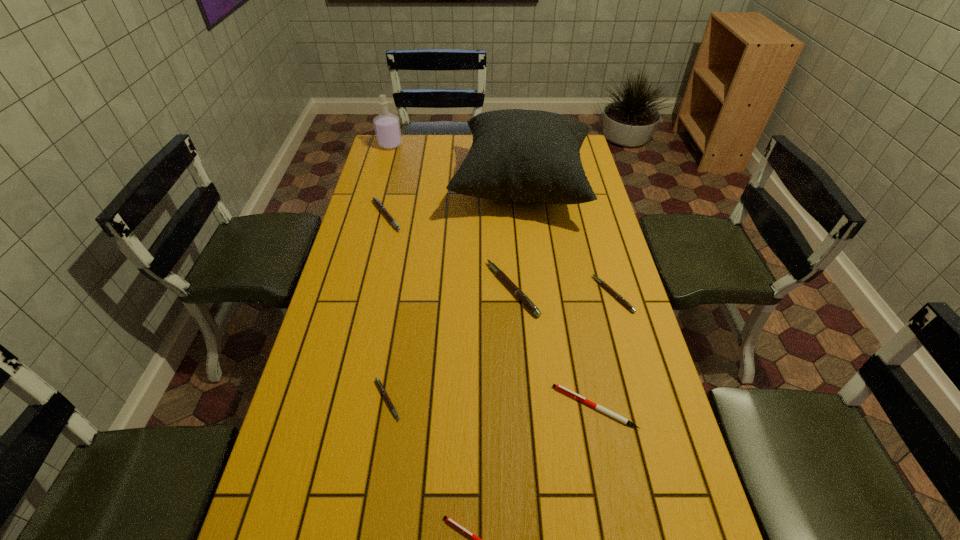
Point out which pen is positioned as the fourth nearest to the fifth pen from right to left. Please provide its 2D coordinates. Your answer should be formatted as a tuple, i.e. [(x, y)], where the tuple contains the x and y coordinates of a point satisfying the conditions above.

[(376, 201)]

Identify the location of the closest pen relative to the perfume. This screenshot has width=960, height=540. (376, 201).

I want to click on pink pen identified as the fourth closest to the black cushion, so click(382, 389).

Select which pink pen is the third closest to the farthest pink pen. Please provide its 2D coordinates. Your answer should be formatted as a tuple, i.e. [(x, y)], where the tuple contains the x and y coordinates of a point satisfying the conditions above.

[(607, 287)]

Choose which white pen is the second nearest neighbor to the black cushion. Please provide its 2D coordinates. Your answer should be formatted as a tuple, i.e. [(x, y)], where the tuple contains the x and y coordinates of a point satisfying the conditions above.

[(476, 539)]

You are a GUI agent. You are given a task and a screenshot of the screen. Output one action in this format:
    pyautogui.click(x=<x>, y=<y>)
    Task: Click on the white pen that can be found as the second closest to the leftmost pen
    The height and width of the screenshot is (540, 960).
    Given the screenshot: What is the action you would take?
    pyautogui.click(x=476, y=539)

At what (x,y) coordinates should I click in order to perform the action: click on free space that satisfies the following two spatial constraints: 1. on the front side of the black cushion; 2. on the right side of the perfume. Please return your answer as a coordinate pair (x, y). The height and width of the screenshot is (540, 960). Looking at the image, I should click on (378, 187).